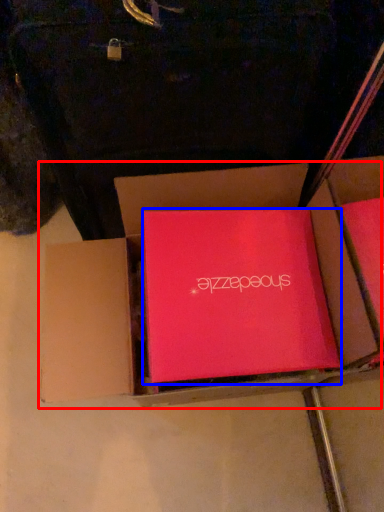
Question: Which object is further to the camera taking this photo, box (highlighted by a red box) or box (highlighted by a blue box)?

Choices:
 (A) box
 (B) box

Answer: (B)